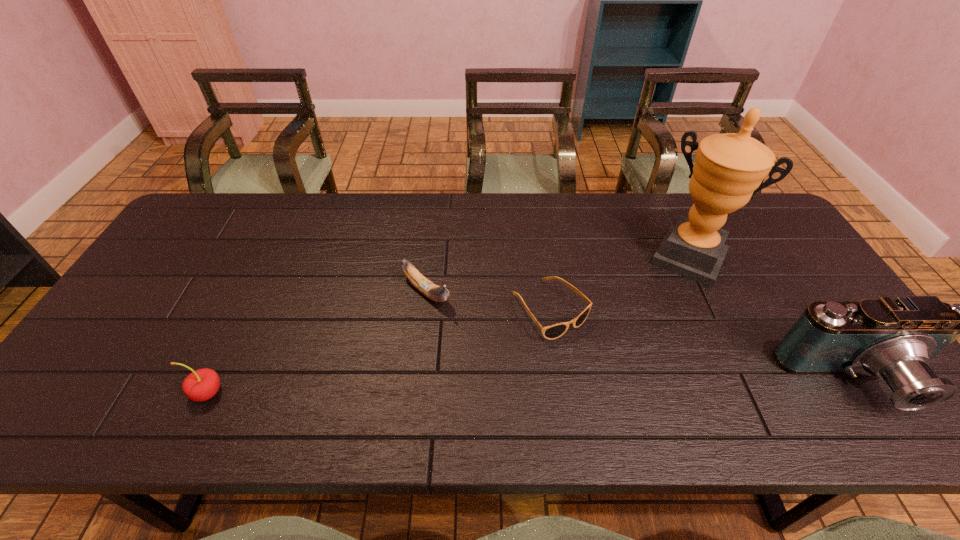
Image resolution: width=960 pixels, height=540 pixels. I want to click on free space on the desktop that is between the cherry and the camcorder and is positioned at the front of the award with handles, so click(627, 386).

Locate an element on the screen. This screenshot has height=540, width=960. vacant space on the desktop that is between the third shortest object and the camcorder and is positioned at the stem of the second object from left to right is located at coordinates (535, 387).

Where is `vacant space on the desktop that is between the third tallest object and the camcorder and is positioned on the front-facing side of the sunglasses`? The width and height of the screenshot is (960, 540). vacant space on the desktop that is between the third tallest object and the camcorder and is positioned on the front-facing side of the sunglasses is located at coordinates (621, 386).